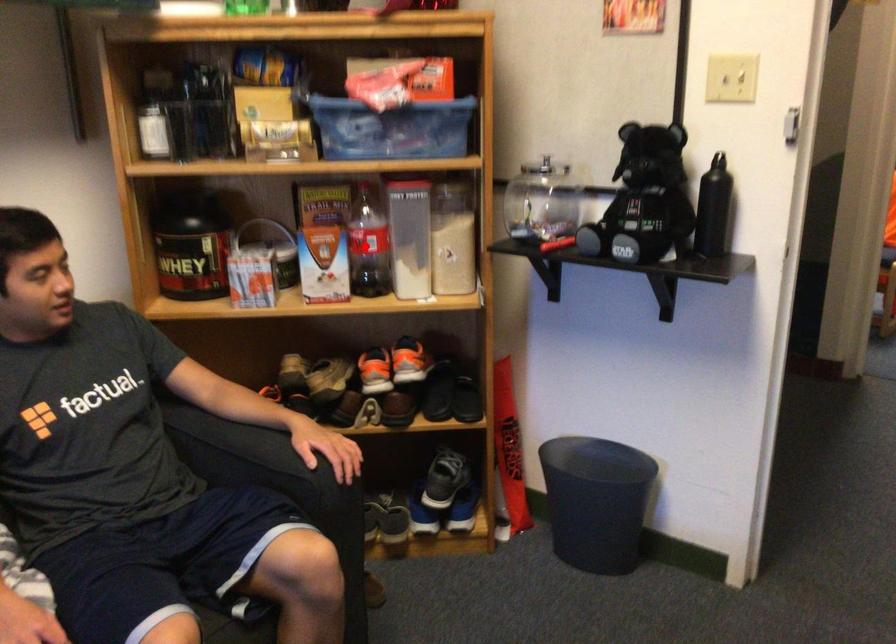
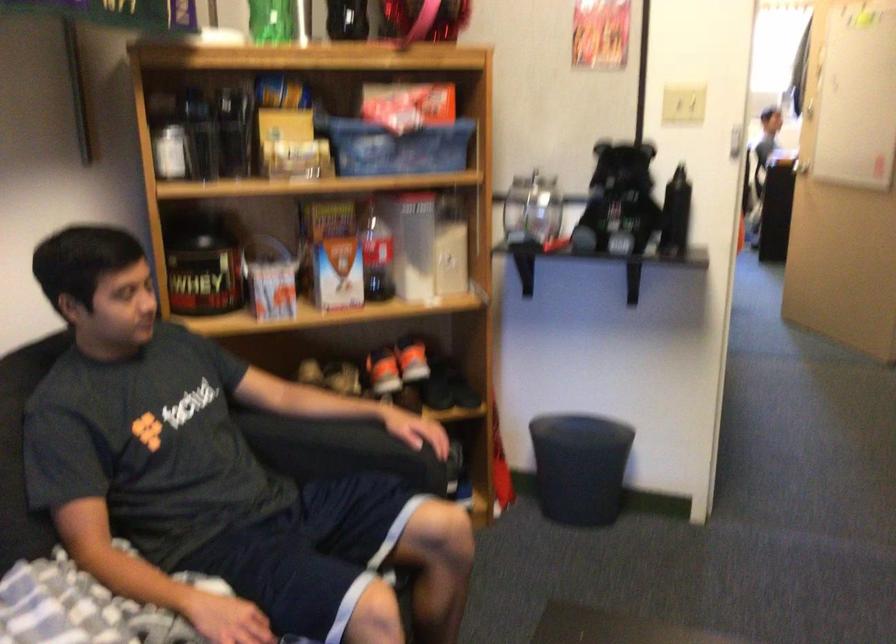
In the second image, find the point that corresponds to the highlighted location in the first image.

(375, 254)